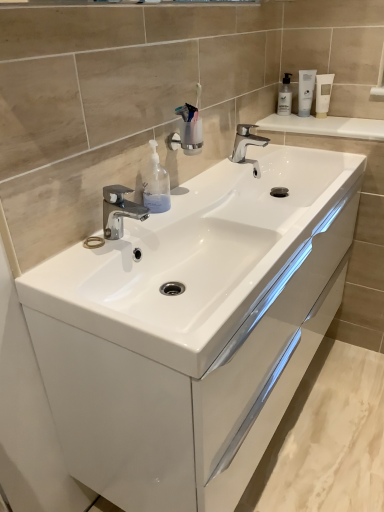
Where is `vacant area in front of transparent plastic soap dispenser at center, which is counted as the 2th soap dispenser, starting from the back`? The height and width of the screenshot is (512, 384). vacant area in front of transparent plastic soap dispenser at center, which is counted as the 2th soap dispenser, starting from the back is located at coordinates (141, 232).